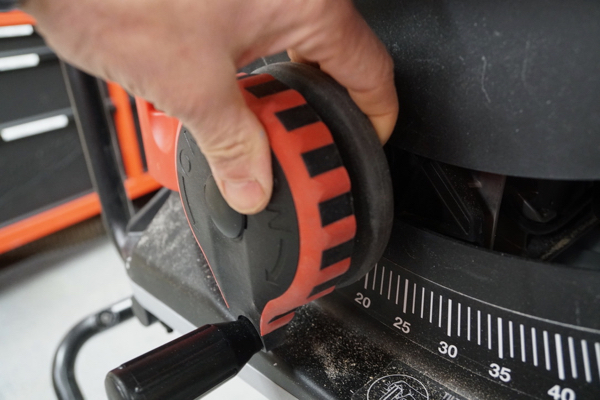
This screenshot has height=400, width=600. Find the location of `horizontal support bar`. horizontal support bar is located at coordinates (55, 373).